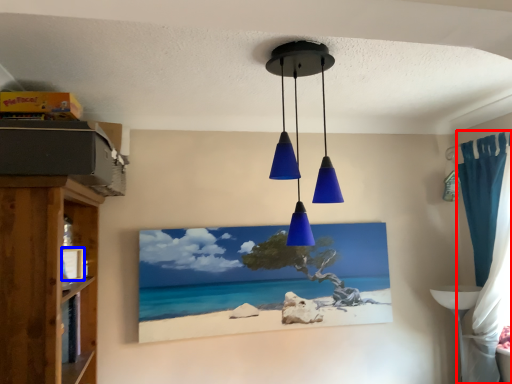
Question: Which point is further to the camera, curtain (highlighted by a red box) or picture frame (highlighted by a blue box)?

Choices:
 (A) curtain
 (B) picture frame

Answer: (A)